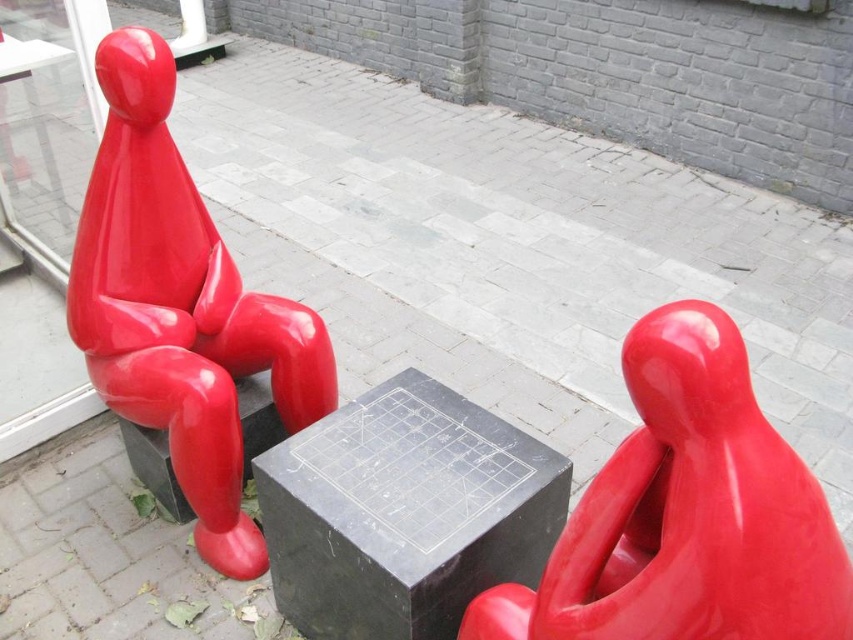
Question: Which point is farther to the camera?

Choices:
 (A) (111, 317)
 (B) (753, 518)

Answer: (A)

Question: Which of the following is the farthest from the observer?

Choices:
 (A) glossy red figure at left
 (B) glossy red figure at right

Answer: (A)

Question: Does glossy red figure at right have a smaller size compared to glossy red figure at left?

Choices:
 (A) yes
 (B) no

Answer: (A)

Question: Which point is closer to the camera?

Choices:
 (A) glossy red figure at right
 (B) glossy red figure at left

Answer: (A)

Question: Is glossy red figure at right smaller than glossy red figure at left?

Choices:
 (A) yes
 (B) no

Answer: (A)

Question: Does glossy red figure at right appear over glossy red figure at left?

Choices:
 (A) no
 (B) yes

Answer: (A)